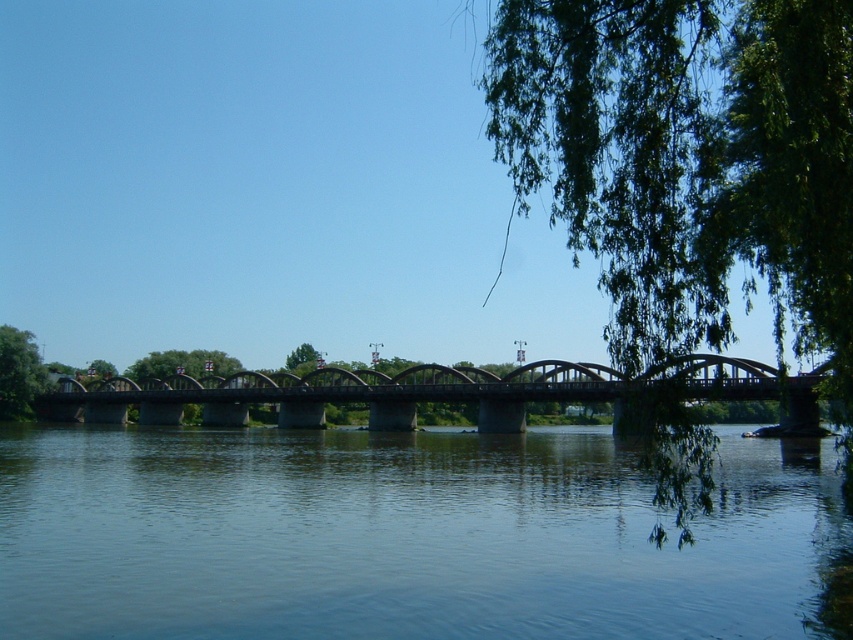
You are a photographer planning to capture the clear blue water at center and the green leafy tree at upper right in a single shot. Based on their heights, which object will appear taller in your photo?

The green leafy tree at upper right will appear taller in the photo because it is taller than the clear blue water at center.

You are standing on the multiarched bridge and looking towards the green leafy tree at upper right. Which direction should you turn to see the clear blue water at center?

You should turn to your left to see the clear blue water at center because it is located to the left of the green leafy tree at upper right.